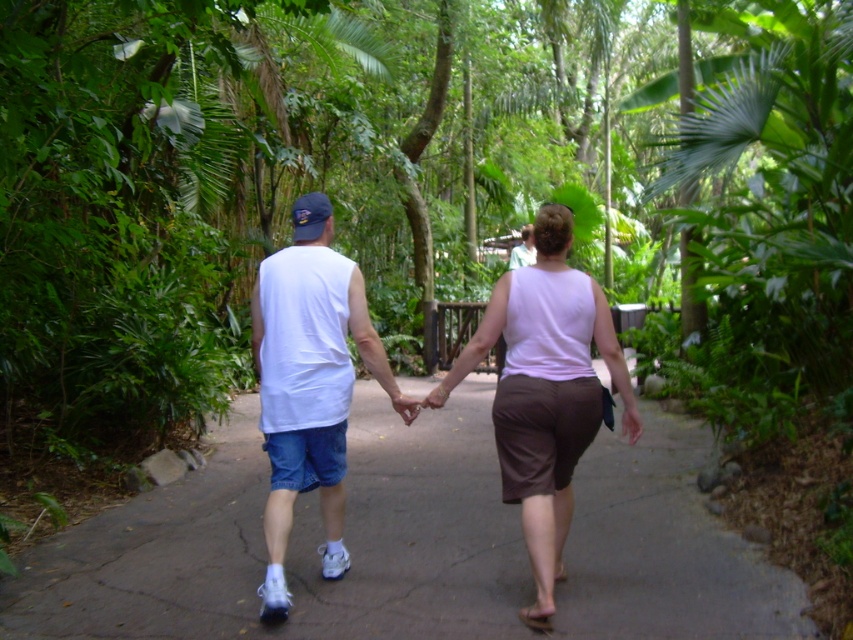
You are a photographer standing behind the two people walking hand in hand. You want to take a photo that includes both the gray concrete pavement at center and the white matte tank top at center. Which object should you adjust your camera to focus on first to ensure both are in frame?

The gray concrete pavement at center is to the left of the white matte tank top at center. To ensure both are in frame, focus on the gray concrete pavement at center first since it is positioned to the left of the white matte tank top at center, allowing the camera to capture both objects in the same shot.

You are a photographer trying to capture the two people in the scene. Since both are wearing white tank tops at center, how can you tell the difference between the white matte tank top at center and the white cotton tank top at center?

The white matte tank top at center is positioned over the white cotton tank top at center, so the one on top would appear in front and might have a smoother, nonreflective surface compared to the cotton one underneath which could show more texture or slight transparency depending on lighting.